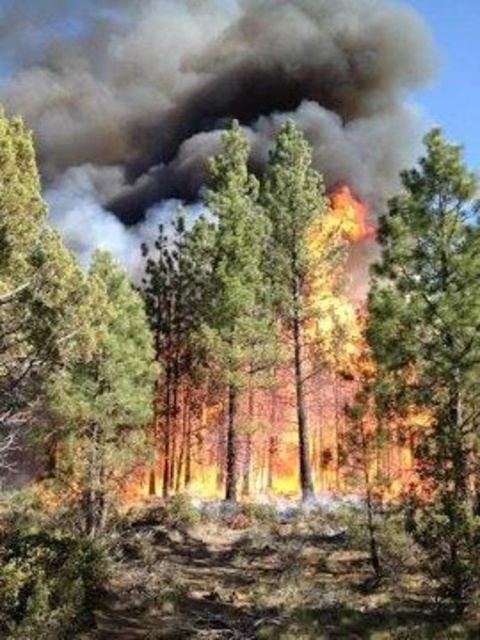
Question: Among these objects, which one is nearest to the camera?

Choices:
 (A) charred wood tree trunk at right
 (B) charred wood tree trunk at center
 (C) green textured pine tree at center

Answer: (A)

Question: Is charred wood tree trunk at right thinner than green matte tree at center?

Choices:
 (A) yes
 (B) no

Answer: (A)

Question: Which point is closer to the camera taking this photo?

Choices:
 (A) (283, 163)
 (B) (99, 442)

Answer: (B)

Question: Does green matte tree at center lie behind green textured pine tree at center?

Choices:
 (A) yes
 (B) no

Answer: (B)

Question: Among these points, which one is nearest to the camera?

Choices:
 (A) (218, 371)
 (B) (297, 138)

Answer: (A)

Question: Can you confirm if green textured pine tree at center is thinner than charred wood tree trunk at center?

Choices:
 (A) yes
 (B) no

Answer: (A)